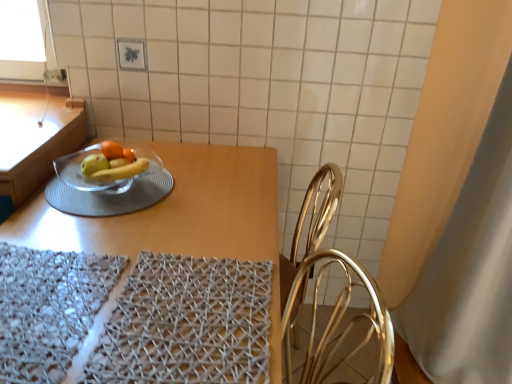
Locate an element on the screen. The image size is (512, 384). vacant space that's between transparent glass bowl at center and woven fabric place mat at lower center, acting as the second place mat starting from the left is located at coordinates (151, 229).